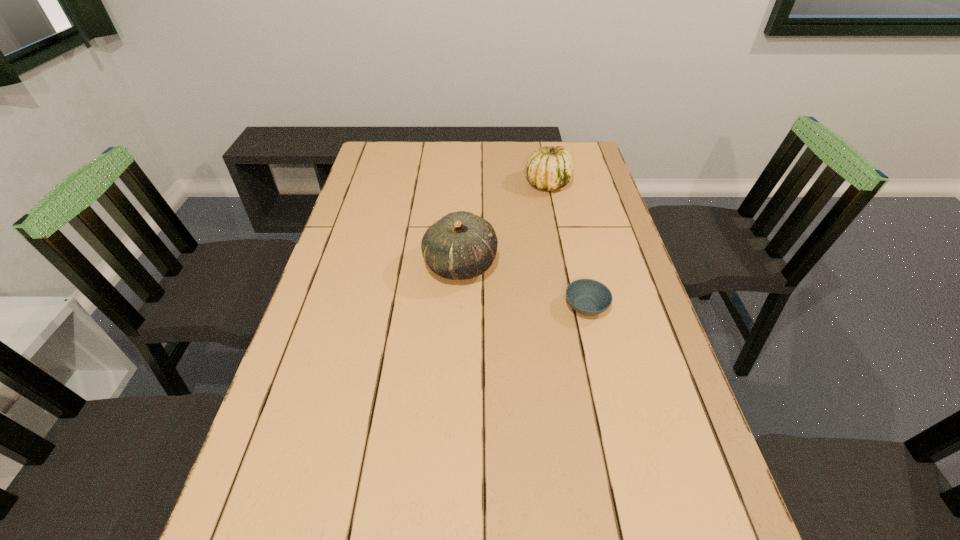
At what (x,y) coordinates should I click in order to perform the action: click on free area in between the second shortest object and the left gourd. Please return your answer as a coordinate pair (x, y). The width and height of the screenshot is (960, 540). Looking at the image, I should click on (504, 224).

The height and width of the screenshot is (540, 960). I want to click on free space between the second shortest object and the shortest object, so click(x=567, y=245).

This screenshot has height=540, width=960. Identify the location of free space between the right gourd and the shortest object. (567, 245).

Identify which object is located as the second nearest to the leftmost object. Please provide its 2D coordinates. Your answer should be formatted as a tuple, i.e. [(x, y)], where the tuple contains the x and y coordinates of a point satisfying the conditions above.

[(549, 168)]

Locate which object is the closest to the shortest object. Please provide its 2D coordinates. Your answer should be formatted as a tuple, i.e. [(x, y)], where the tuple contains the x and y coordinates of a point satisfying the conditions above.

[(461, 245)]